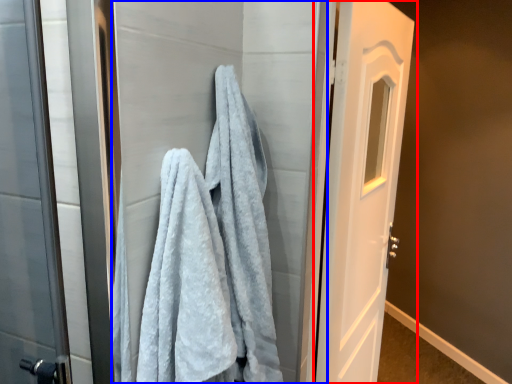
Question: Which object is further to the camera taking this photo, door (highlighted by a red box) or screen door (highlighted by a blue box)?

Choices:
 (A) door
 (B) screen door

Answer: (A)